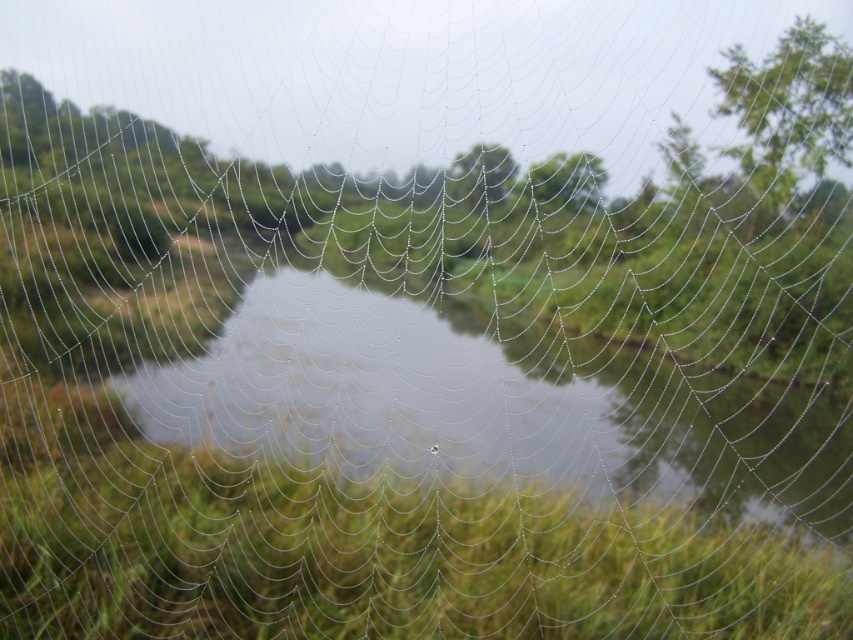
You are a bird looking for a place to land. You see the green leafy tree at upper right and the green leafy tree at upper center in the image. Which tree is closer to the spiderweb in the foreground?

The green leafy tree at upper center is closer to the spiderweb in the foreground than the green leafy tree at upper right because they are 5.75 meters apart.

You are standing in a natural setting and see a spiderweb with dew droplets. There is a point marked at coordinates (x=788, y=109). What does this point indicate in the scene?

The point at (x=788, y=109) marks the location of the green leafy tree at upper right.